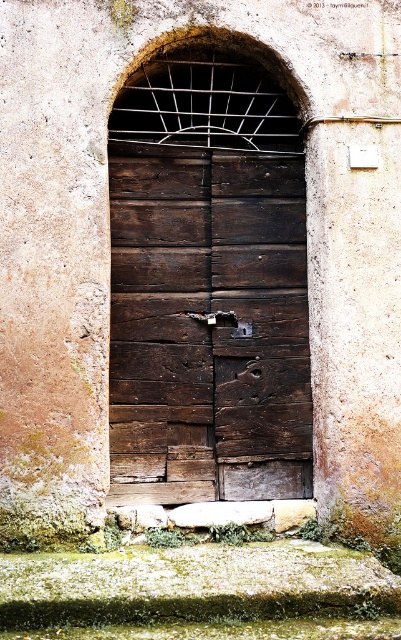
Can you confirm if dark wood door at center is positioned below metallic dark brown lock at center?

No.

What do you see at coordinates (208, 324) in the screenshot?
I see `dark wood door at center` at bounding box center [208, 324].

Locate an element on the screen. The image size is (401, 640). dark wood door at center is located at coordinates (208, 324).